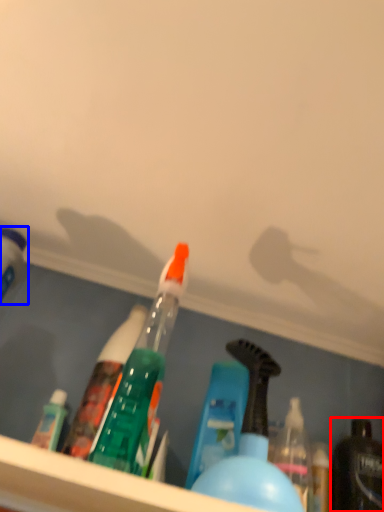
Question: Which object appears closest to the camera in this image, bottle (highlighted by a red box) or bottle (highlighted by a blue box)?

Choices:
 (A) bottle
 (B) bottle

Answer: (B)